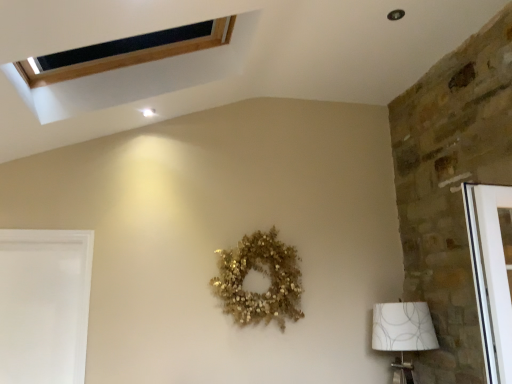
Question: Can you confirm if white fabric lampshade at lower right is positioned to the left of white matte screen door at lower left?

Choices:
 (A) no
 (B) yes

Answer: (A)

Question: From a real-world perspective, is white fabric lampshade at lower right located higher than white matte screen door at lower left?

Choices:
 (A) no
 (B) yes

Answer: (A)

Question: Can you confirm if white fabric lampshade at lower right is taller than white matte screen door at lower left?

Choices:
 (A) no
 (B) yes

Answer: (A)

Question: Can you confirm if white fabric lampshade at lower right is shorter than white matte screen door at lower left?

Choices:
 (A) yes
 (B) no

Answer: (A)

Question: Can you confirm if white fabric lampshade at lower right is thinner than white matte screen door at lower left?

Choices:
 (A) yes
 (B) no

Answer: (B)

Question: Can you confirm if white fabric lampshade at lower right is wider than white matte screen door at lower left?

Choices:
 (A) yes
 (B) no

Answer: (A)

Question: From the image's perspective, is white matte screen door at lower left below white fabric lampshade at lower right?

Choices:
 (A) yes
 (B) no

Answer: (B)

Question: Would you say white matte screen door at lower left is outside white fabric lampshade at lower right?

Choices:
 (A) no
 (B) yes

Answer: (B)

Question: Considering the relative sizes of white matte screen door at lower left and white fabric lampshade at lower right in the image provided, is white matte screen door at lower left smaller than white fabric lampshade at lower right?

Choices:
 (A) no
 (B) yes

Answer: (B)

Question: Is white matte screen door at lower left wider than white fabric lampshade at lower right?

Choices:
 (A) yes
 (B) no

Answer: (B)

Question: Is white matte screen door at lower left next to white fabric lampshade at lower right?

Choices:
 (A) no
 (B) yes

Answer: (A)

Question: Can you confirm if white matte screen door at lower left is shorter than white fabric lampshade at lower right?

Choices:
 (A) no
 (B) yes

Answer: (A)

Question: Is point (391, 337) positioned closer to the camera than point (53, 342)?

Choices:
 (A) farther
 (B) closer

Answer: (B)